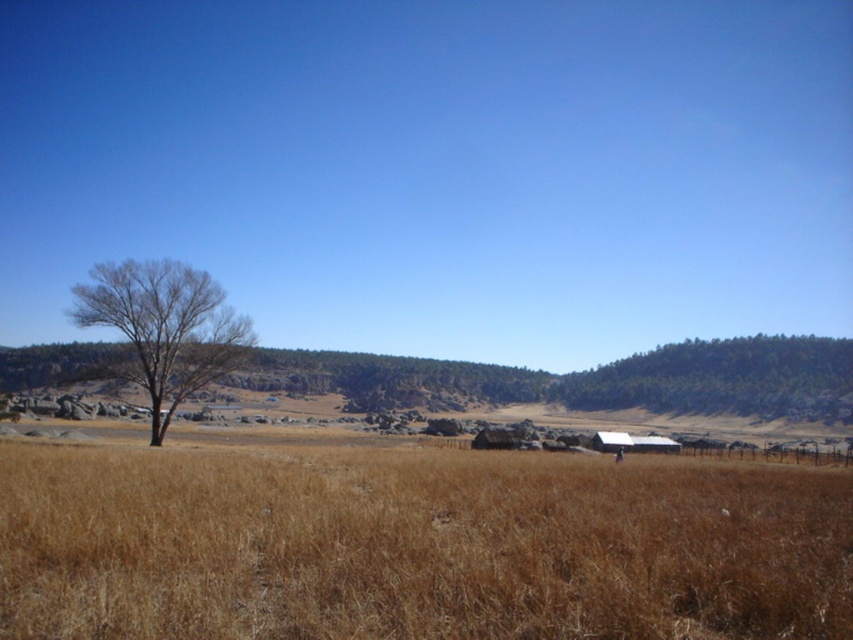
Question: Is brown dry grass at center to the right of bare wood tree at left from the viewer's perspective?

Choices:
 (A) no
 (B) yes

Answer: (B)

Question: Observing the image, what is the correct spatial positioning of brown dry grass at center in reference to bare wood tree at left?

Choices:
 (A) left
 (B) right

Answer: (B)

Question: Which point is closer to the camera?

Choices:
 (A) brown dry grass at center
 (B) bare wood tree at left

Answer: (A)

Question: Can you confirm if brown dry grass at center is positioned above bare wood tree at left?

Choices:
 (A) no
 (B) yes

Answer: (A)